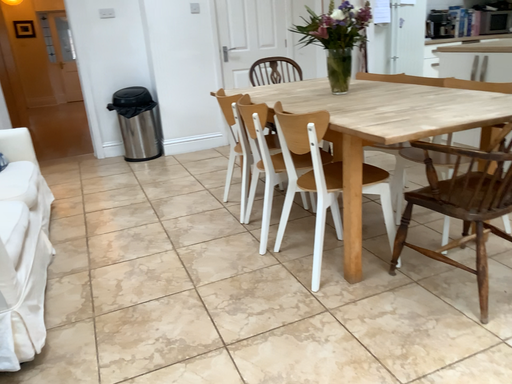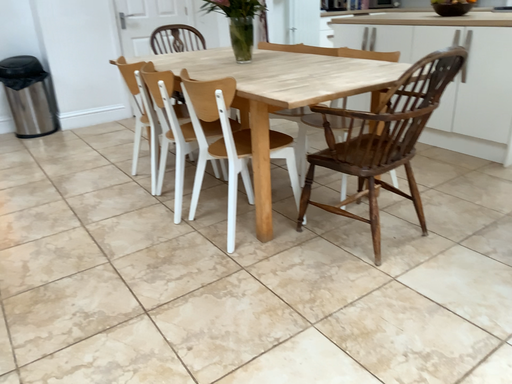
Question: How did the camera likely rotate when shooting the video?

Choices:
 (A) rotated right
 (B) rotated left

Answer: (A)